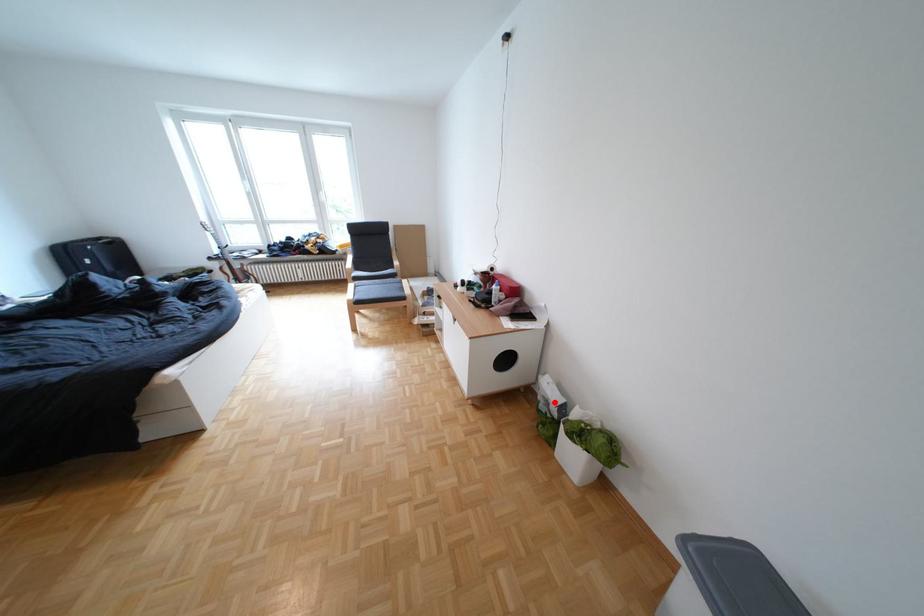
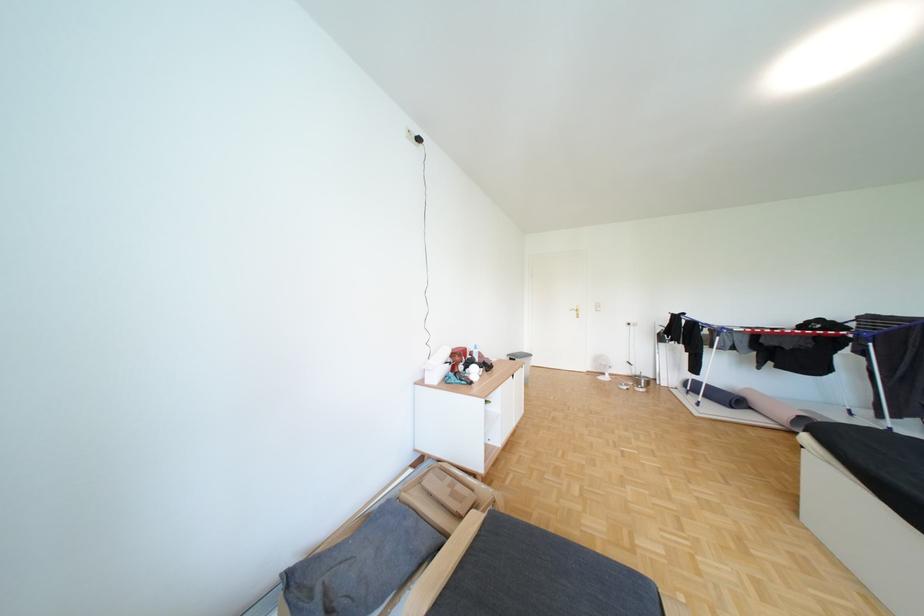
Question: I am providing you with two images of the same scene from different viewpoints. A red point is marked on the first image. Can you still see the location of the red point in image 2?

Choices:
 (A) Yes
 (B) No

Answer: (B)